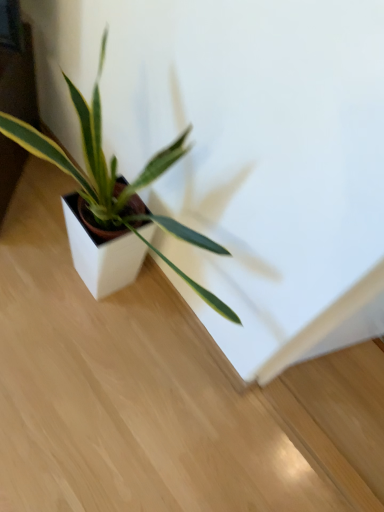
What do you see at coordinates (114, 181) in the screenshot? I see `green matte plant at center-left` at bounding box center [114, 181].

Where is `green matte plant at center-left`? The image size is (384, 512). green matte plant at center-left is located at coordinates (114, 181).

Find the location of a particular element. green matte plant at center-left is located at coordinates (114, 181).